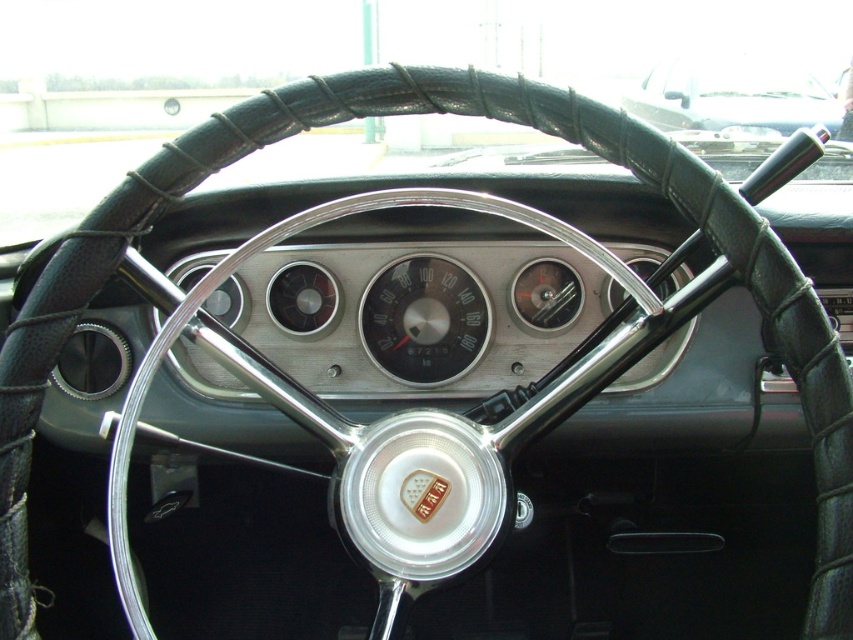
You are sitting in the driver seat of the vintage car and want to locate the point at coordinates (733,96). Based on the description, where exactly is this point located?

The point at coordinates (733,96) is on the black leather steering wheel at upper center.

You are a mechanic examining the vintage car from the image. You need to adjust the height of the black leather steering wheel at upper center so that it aligns with the matte silver gauge at center. Based on their current heights, which object should you lower or raise?

The black leather steering wheel at upper center is much taller than the matte silver gauge at center. To align them, you should lower the black leather steering wheel at upper center.

You are sitting in the driver seat of the vintage car and want to check the speedometer located at the matte silver gauge at center. However, the black leather steering wheel at upper center is blocking your view. Can you adjust your seating position to see the speedometer clearly?

The matte silver gauge at center is behind the black leather steering wheel at upper center, so adjusting your seating position may allow you to see the speedometer by moving closer or tilting your head slightly to look around the steering wheel.